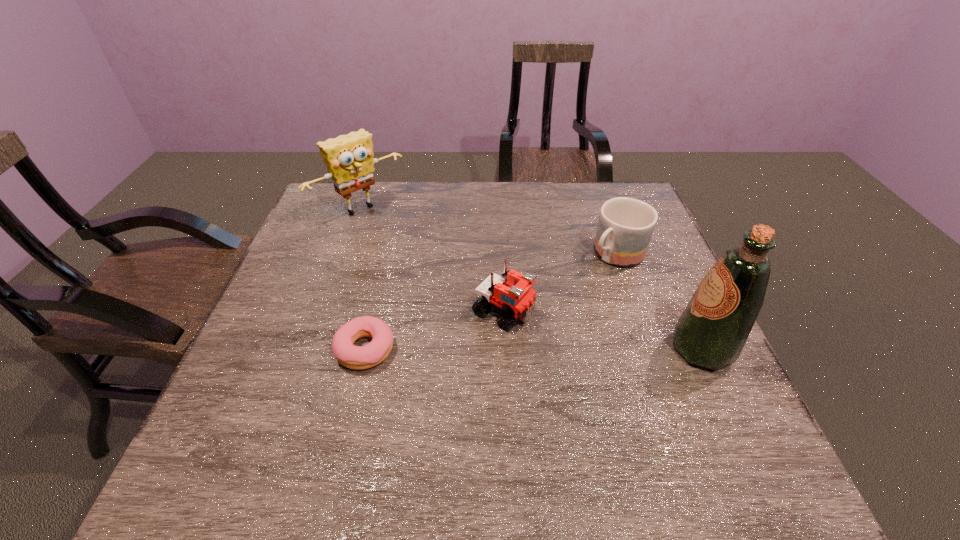
Image resolution: width=960 pixels, height=540 pixels. Find the location of `free space that is in between the farthest object and the Lego`. free space that is in between the farthest object and the Lego is located at coordinates coord(432,260).

Find the location of a particular element. The height and width of the screenshot is (540, 960). blank region between the shortest object and the sponge is located at coordinates (363, 279).

You are a GUI agent. You are given a task and a screenshot of the screen. Output one action in this format:
    pyautogui.click(x=<x>, y=<y>)
    Task: Click on the free space between the sponge and the mug
    
    Given the screenshot: What is the action you would take?
    pyautogui.click(x=489, y=232)

Identify the location of free spot between the tallest object and the Lego. (603, 329).

Find the location of a particular element. This screenshot has height=540, width=960. free spot between the tallest object and the doughnut is located at coordinates (534, 349).

Where is `blank region between the shortest object and the second tallest object`? blank region between the shortest object and the second tallest object is located at coordinates (363, 279).

The image size is (960, 540). I want to click on free space between the fourth shortest object and the mug, so click(x=489, y=232).

Locate an element on the screen. The width and height of the screenshot is (960, 540). vacant point located between the mug and the sponge is located at coordinates [x=489, y=232].

Identify which object is the third nearest to the Lego. Please provide its 2D coordinates. Your answer should be formatted as a tuple, i.e. [(x, y)], where the tuple contains the x and y coordinates of a point satisfying the conditions above.

[(711, 332)]

Point out which object is positioned as the nearest to the olive oil. Please provide its 2D coordinates. Your answer should be formatted as a tuple, i.e. [(x, y)], where the tuple contains the x and y coordinates of a point satisfying the conditions above.

[(625, 227)]